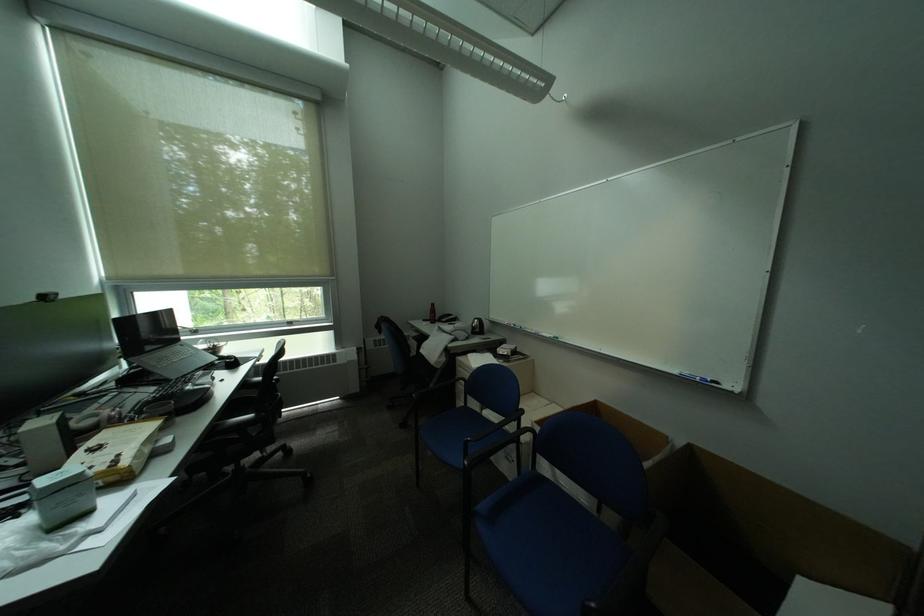
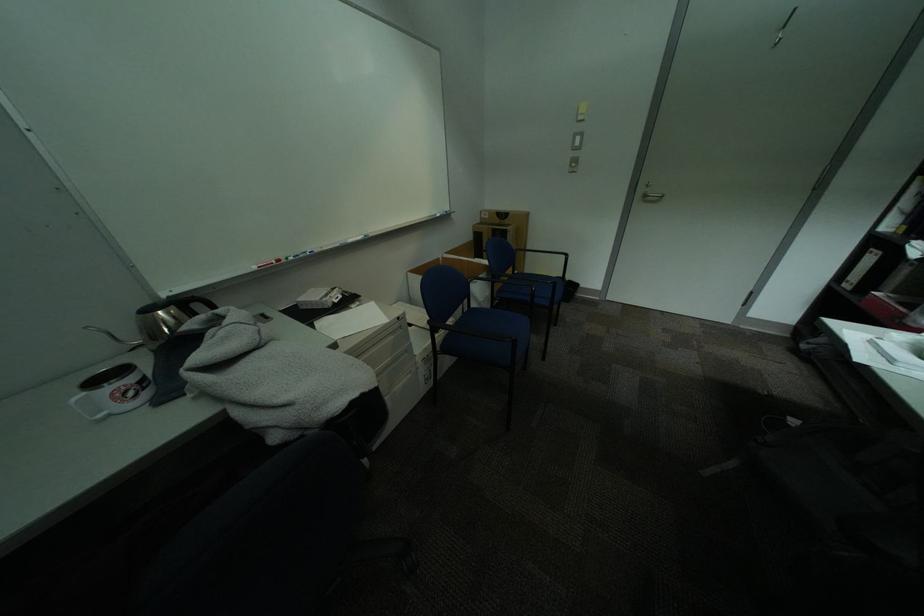
Locate, in the second image, the point that corresponds to point (678, 438) in the first image.

(450, 259)